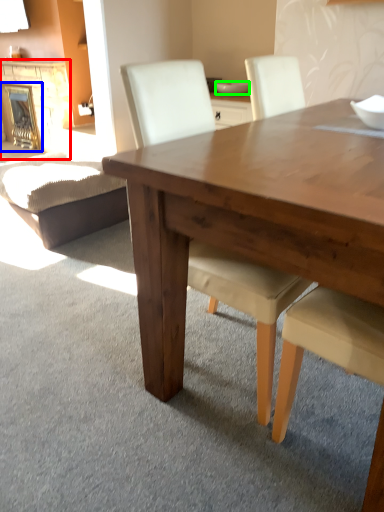
Question: Considering the real-world distances, which object is farthest from fireplace (highlighted by a red box)? fireplace (highlighted by a blue box) or bowl (highlighted by a green box)?

Choices:
 (A) fireplace
 (B) bowl

Answer: (B)